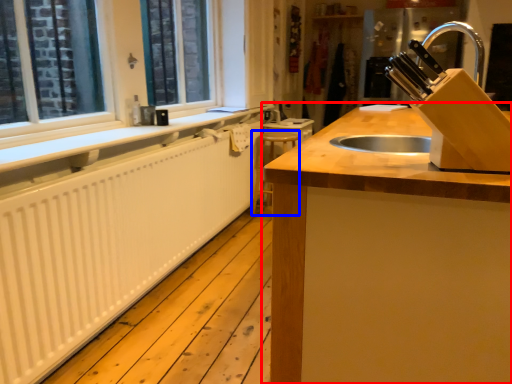
Question: Which point is closer to the camera, countertop (highlighted by a red box) or step stool (highlighted by a blue box)?

Choices:
 (A) countertop
 (B) step stool

Answer: (A)